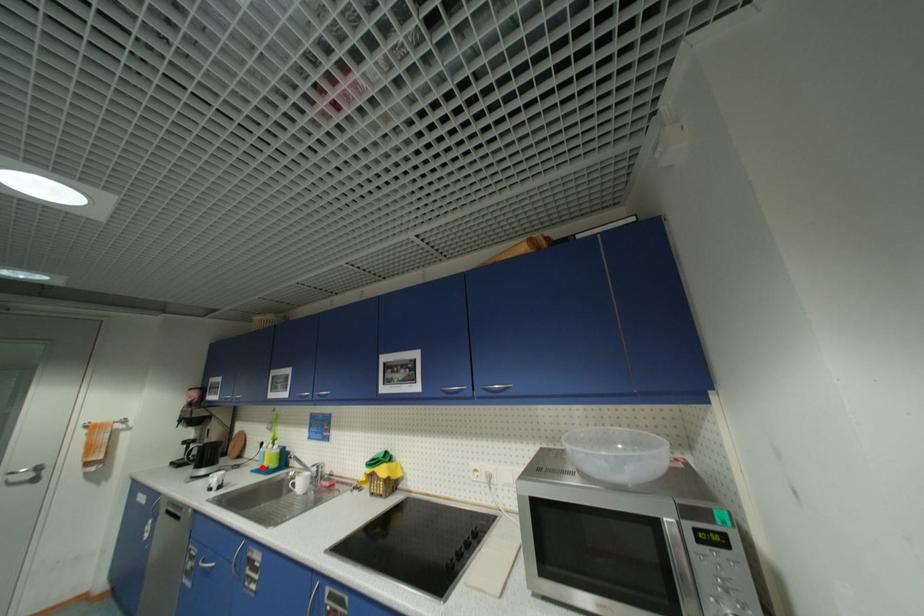
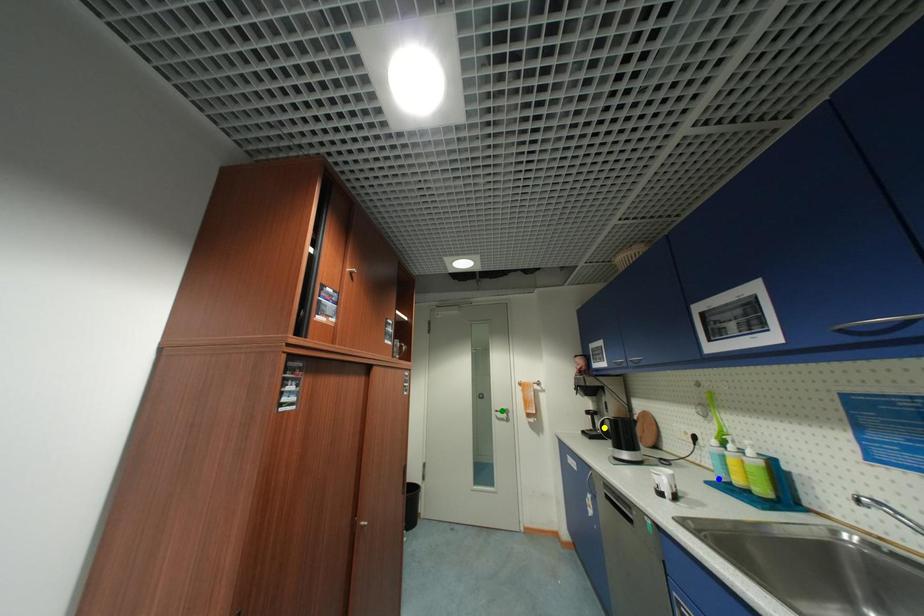
Question: I am providing you with two images of the same scene from different viewpoints. A red point is marked on the first image. You are given multiple points on the second image. In image 2, which mark is for the same physical point as the one in image 1?

Choices:
 (A) green point
 (B) yellow point
 (C) blue point

Answer: (C)